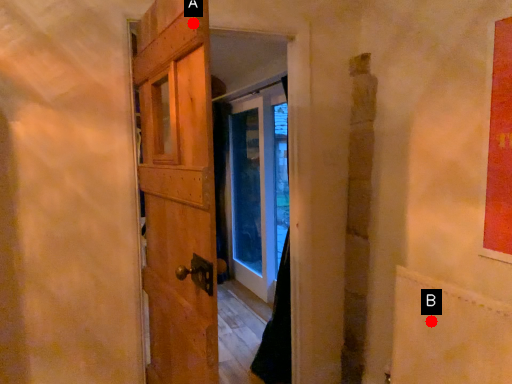
Question: Two points are circled on the image, labeled by A and B beside each circle. Which point is further to the camera?

Choices:
 (A) A is further
 (B) B is further

Answer: (B)